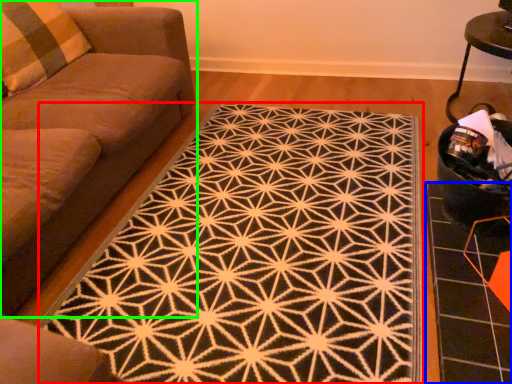
Question: Estimate the real-world distances between objects in this image. Which object is farther from mat (highlighted by a red box), tile (highlighted by a blue box) or studio couch (highlighted by a green box)?

Choices:
 (A) tile
 (B) studio couch

Answer: (B)